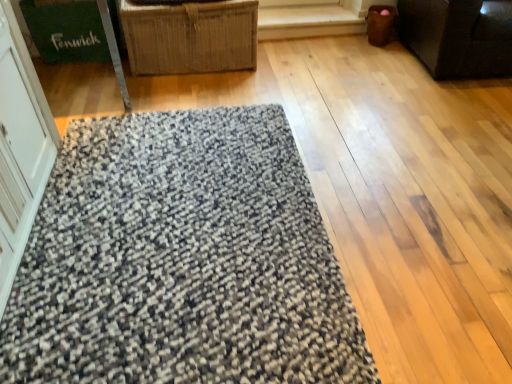
Question: Considering the positions of white glossy screen door at left and textured gray mat at center in the image, is white glossy screen door at left wider or thinner than textured gray mat at center?

Choices:
 (A) wide
 (B) thin

Answer: (B)

Question: From a real-world perspective, is white glossy screen door at left positioned above or below textured gray mat at center?

Choices:
 (A) below
 (B) above

Answer: (B)

Question: Which of these objects is positioned closest to the white glossy screen door at left?

Choices:
 (A) green cardboard box at upper left
 (B) textured gray mat at center
 (C) woven straw basket at upper center, which is counted as the first furniture, starting from the left
 (D) dark brown fabric couch at upper right, which appears as the 2th furniture when viewed from the left

Answer: (B)

Question: Estimate the real-world distances between objects in this image. Which object is farther from the white glossy screen door at left?

Choices:
 (A) green cardboard box at upper left
 (B) textured gray mat at center
 (C) dark brown fabric couch at upper right, which ranks as the first furniture in right-to-left order
 (D) woven straw basket at upper center, which ranks as the second furniture in right-to-left order

Answer: (C)